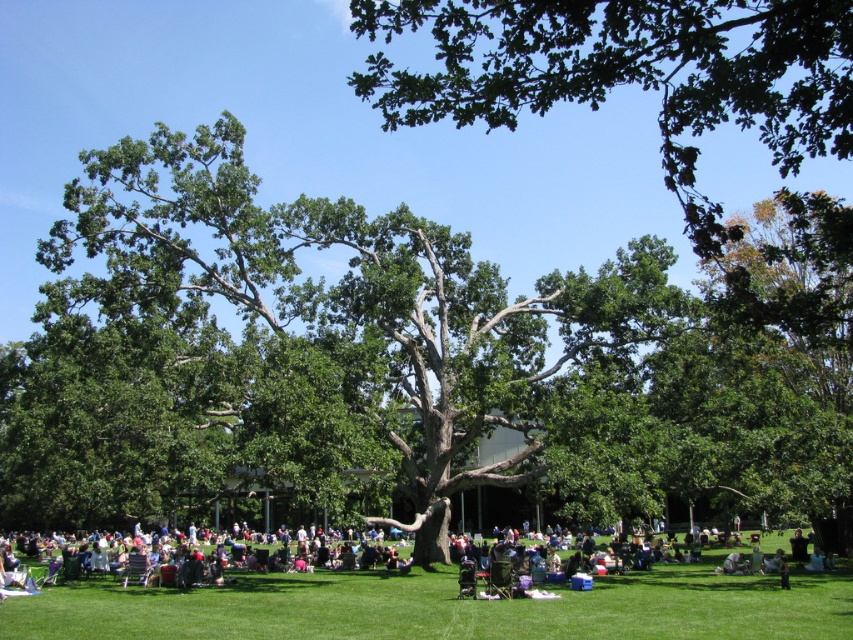
Question: Which is farther from the green leafy tree at upper center?

Choices:
 (A) green leafy tree at center
 (B) dark green fabric chair at lower center

Answer: (B)

Question: Can you confirm if green leafy tree at center is thinner than dark green fabric chair at lower center?

Choices:
 (A) no
 (B) yes

Answer: (A)

Question: Does green leafy tree at center have a greater width compared to dark green fabric chair at lower center?

Choices:
 (A) yes
 (B) no

Answer: (A)

Question: Which object appears farthest from the camera in this image?

Choices:
 (A) green leafy tree at upper center
 (B) dark green fabric chair at lower center
 (C) green leafy tree at center

Answer: (B)

Question: Does green leafy tree at center have a larger size compared to dark green fabric chair at lower center?

Choices:
 (A) yes
 (B) no

Answer: (A)

Question: Which of the following is the farthest from the observer?

Choices:
 (A) (845, 148)
 (B) (190, 589)
 (C) (329, 216)

Answer: (C)